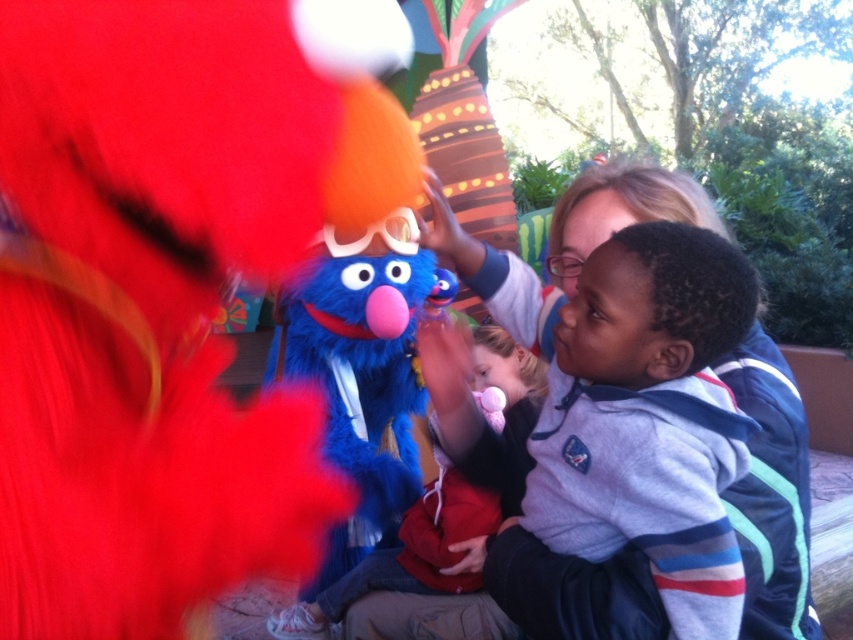
Is smooth blond hair at upper center thinner than fluffy blue costume at center?

Indeed, smooth blond hair at upper center has a lesser width compared to fluffy blue costume at center.

Is point (553, 456) farther from viewer compared to point (454, 547)?

No, it is in front of (454, 547).

Between point (647, 396) and point (498, 502), which one is positioned in front?

Point (647, 396)

I want to click on smooth blond hair at upper center, so click(x=631, y=476).

Who is higher up, smooth blond hair at upper center or fuzzy blue puppet at center?

smooth blond hair at upper center is higher up.

You are a GUI agent. You are given a task and a screenshot of the screen. Output one action in this format:
    pyautogui.click(x=<x>, y=<y>)
    Task: Click on the smooth blond hair at upper center
    
    Given the screenshot: What is the action you would take?
    (x=631, y=476)

Can you confirm if fuzzy blue puppet at center is bigger than fluffy blue costume at center?

Incorrect, fuzzy blue puppet at center is not larger than fluffy blue costume at center.

Image resolution: width=853 pixels, height=640 pixels. What do you see at coordinates (361, 372) in the screenshot?
I see `fuzzy blue puppet at center` at bounding box center [361, 372].

Who is more forward, (370, 317) or (469, 516)?

Point (469, 516)

Find the location of `fuzzy blue puppet at center`. fuzzy blue puppet at center is located at coordinates (361, 372).